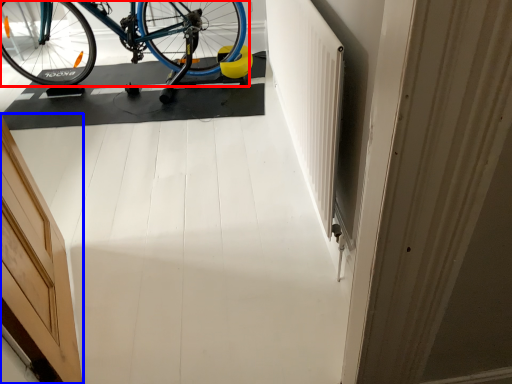
Question: Which object appears farthest to the camera in this image, bicycle (highlighted by a red box) or door (highlighted by a blue box)?

Choices:
 (A) bicycle
 (B) door

Answer: (A)